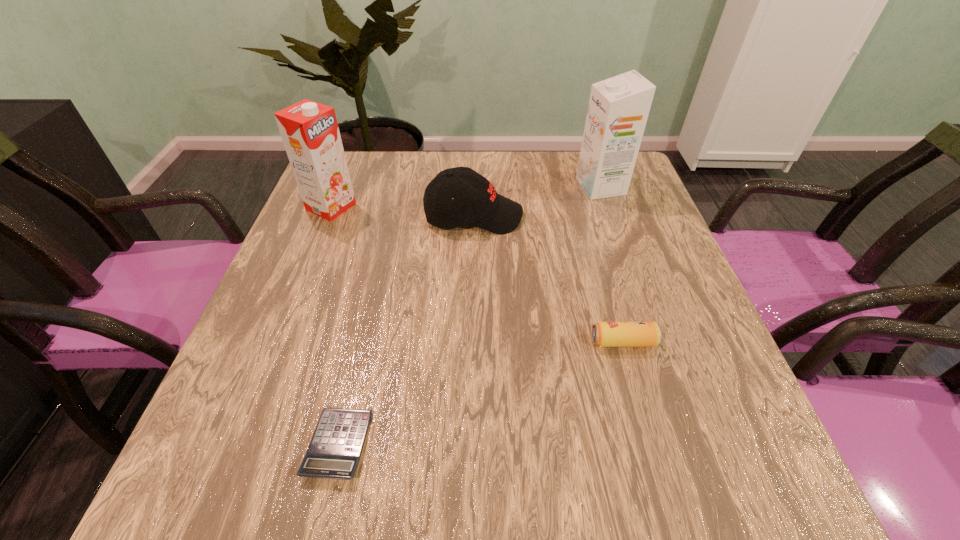
This screenshot has width=960, height=540. What are the coordinates of `vacant point located 0.230m on the front-facing side of the baseball cap` in the screenshot? It's located at (614, 216).

This screenshot has height=540, width=960. Find the location of `vacant area situated on the front of the fourth farthest object`. vacant area situated on the front of the fourth farthest object is located at coordinates point(659,467).

The width and height of the screenshot is (960, 540). Identify the location of free space located 0.180m on the right of the nearest object. (482, 444).

Find the location of a particular element. baseball cap that is at the far edge is located at coordinates (475, 201).

The height and width of the screenshot is (540, 960). I want to click on object situated at the near edge, so click(x=334, y=452).

I want to click on object located in the left edge section of the desktop, so click(x=309, y=130).

In order to click on carton located in the right edge section of the desktop in this screenshot , I will do pos(618,109).

The width and height of the screenshot is (960, 540). Identify the location of beer can located in the right edge section of the desktop. (604, 334).

At what (x,y) coordinates should I click in order to perform the action: click on object located in the far left corner section of the desktop. Please return your answer as a coordinate pair (x, y). This screenshot has width=960, height=540. Looking at the image, I should click on (309, 130).

Find the location of a particular element. object present at the far right corner is located at coordinates (618, 109).